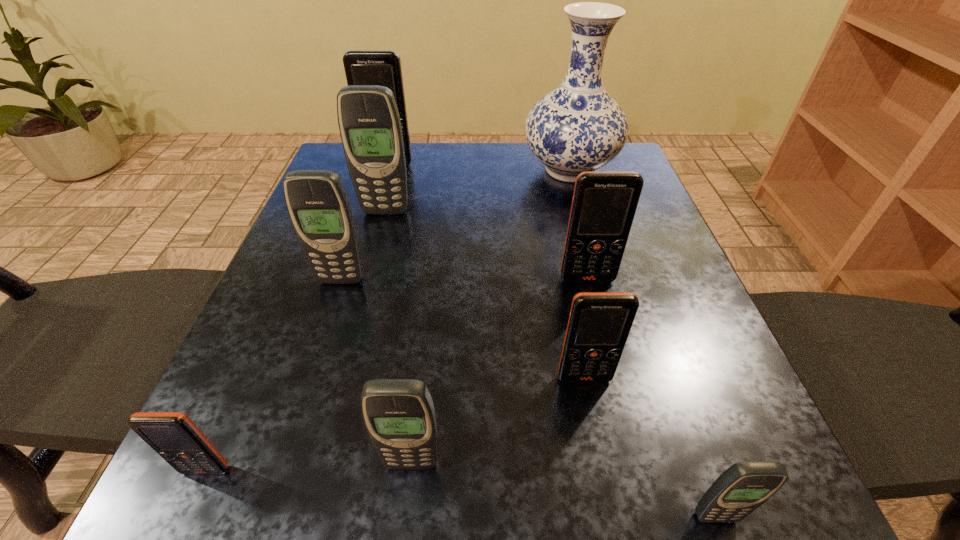
Locate an element on the screen. Image resolution: width=960 pixels, height=540 pixels. free spot between the second smallest gray cellular telephone and the nearest cellular telephone is located at coordinates (564, 490).

Locate an element on the screen. empty location between the third nearest orange cellular telephone and the seventh nearest cellular telephone is located at coordinates (487, 246).

Find the location of a particular element. free space between the biggest orange cellular telephone and the leftmost orange cellular telephone is located at coordinates (298, 317).

Point out which object is positioned as the seventh nearest to the leftmost orange cellular telephone. Please provide its 2D coordinates. Your answer should be formatted as a tuple, i.e. [(x, y)], where the tuple contains the x and y coordinates of a point satisfying the conditions above.

[(362, 67)]

At what (x,y) coordinates should I click in order to perform the action: click on object identified as the closest to the second farthest gray cellular telephone. Please return your answer as a coordinate pair (x, y). Image resolution: width=960 pixels, height=540 pixels. Looking at the image, I should click on (370, 128).

Select which cellular telephone appears as the third closest to the second farthest cellular telephone. Please provide its 2D coordinates. Your answer should be formatted as a tuple, i.e. [(x, y)], where the tuple contains the x and y coordinates of a point satisfying the conditions above.

[(604, 204)]

Locate which cellular telephone is the fourth closest to the second biggest orange cellular telephone. Please provide its 2D coordinates. Your answer should be formatted as a tuple, i.e. [(x, y)], where the tuple contains the x and y coordinates of a point satisfying the conditions above.

[(399, 415)]

The image size is (960, 540). In order to click on orange cellular telephone that is the closest one to the leftmost object in this screenshot , I will do `click(599, 323)`.

At what (x,y) coordinates should I click in order to perform the action: click on orange cellular telephone that can be found as the closest to the biggest orange cellular telephone. Please return your answer as a coordinate pair (x, y). Looking at the image, I should click on (604, 204).

The width and height of the screenshot is (960, 540). I want to click on gray cellular telephone that is the second closest to the vase, so click(318, 205).